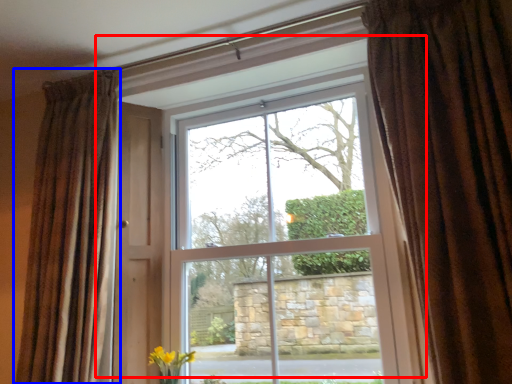
Question: Which object appears farthest to the camera in this image, window (highlighted by a red box) or curtain (highlighted by a blue box)?

Choices:
 (A) window
 (B) curtain

Answer: (A)